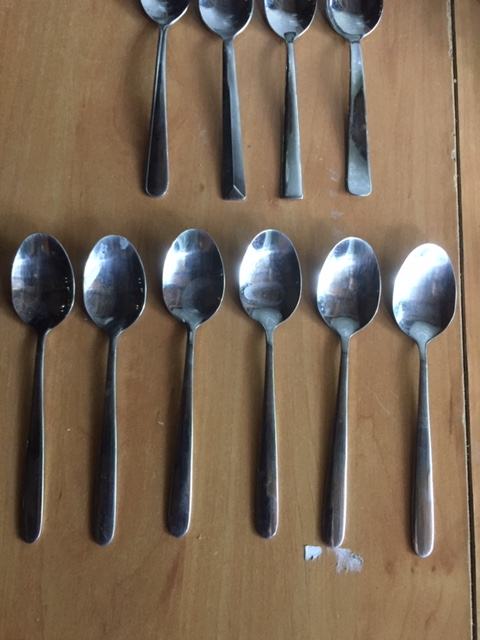
At what (x,y) coordinates should I click in order to perform the action: click on spoon handle. Please return your answer as a coordinate pair (x, y). Looking at the image, I should click on (28, 505), (104, 508), (179, 493), (267, 506), (333, 509), (420, 518), (358, 166), (293, 166), (235, 161), (155, 166).